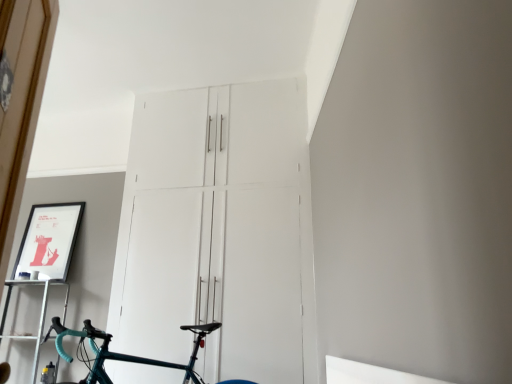
Question: Does metallic silver shelf at lower left touch white matte cabinet at center?

Choices:
 (A) no
 (B) yes

Answer: (A)

Question: Is metallic silver shelf at lower left positioned with its back to white matte cabinet at center?

Choices:
 (A) no
 (B) yes

Answer: (A)

Question: Is white matte cabinet at center inside metallic silver shelf at lower left?

Choices:
 (A) yes
 (B) no

Answer: (B)

Question: From the image's perspective, does metallic silver shelf at lower left appear higher than white matte cabinet at center?

Choices:
 (A) no
 (B) yes

Answer: (A)

Question: From the image's perspective, would you say metallic silver shelf at lower left is shown under white matte cabinet at center?

Choices:
 (A) no
 (B) yes

Answer: (B)

Question: Does metallic silver shelf at lower left have a smaller size compared to white matte cabinet at center?

Choices:
 (A) no
 (B) yes

Answer: (B)

Question: Is metallic silver shelf at lower left shorter than matte black picture frame at upper left?

Choices:
 (A) no
 (B) yes

Answer: (A)

Question: Can you confirm if metallic silver shelf at lower left is wider than matte black picture frame at upper left?

Choices:
 (A) no
 (B) yes

Answer: (B)

Question: Is metallic silver shelf at lower left with matte black picture frame at upper left?

Choices:
 (A) yes
 (B) no

Answer: (B)

Question: Is metallic silver shelf at lower left further to camera compared to matte black picture frame at upper left?

Choices:
 (A) yes
 (B) no

Answer: (B)

Question: From a real-world perspective, is metallic silver shelf at lower left located beneath matte black picture frame at upper left?

Choices:
 (A) yes
 (B) no

Answer: (A)

Question: Is metallic silver shelf at lower left closer to the viewer compared to matte black picture frame at upper left?

Choices:
 (A) yes
 (B) no

Answer: (A)

Question: Is matte black picture frame at upper left positioned with its back to teal glossy bicycle at center?

Choices:
 (A) yes
 (B) no

Answer: (B)